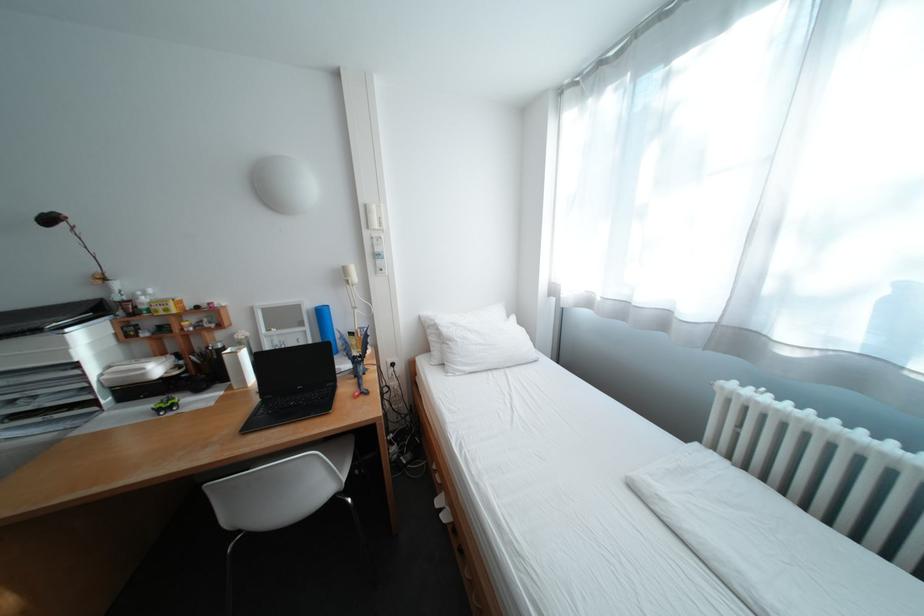
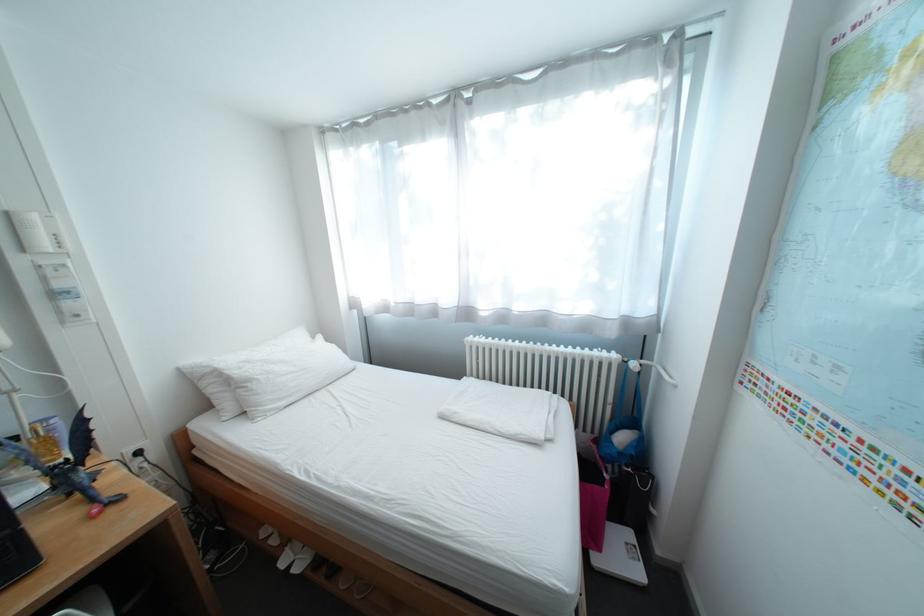
Where in the second image is the point corresponding to the point at 465,342 from the first image?

(263, 383)